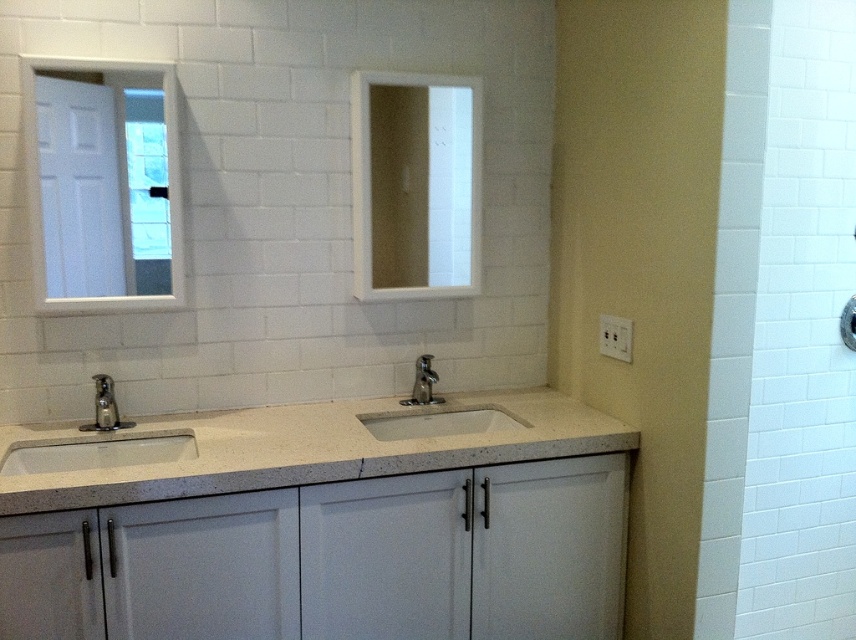
Who is shorter, white matte sink at lower left or matte silver faucet at left?

white matte sink at lower left

Is point (123, 445) positioned behind point (104, 406)?

Yes.

Measure the distance between point (x=156, y=442) and camera.

They are 6.95 feet apart.

Where is `white matte sink at lower left`? Image resolution: width=856 pixels, height=640 pixels. white matte sink at lower left is located at coordinates (97, 451).

Does white matte medicine cabinet at upper center have a greater height compared to matte silver faucet at left?

Yes.

Does white matte medicine cabinet at upper center appear on the right side of matte silver faucet at left?

Correct, you'll find white matte medicine cabinet at upper center to the right of matte silver faucet at left.

Which is in front, point (357, 80) or point (98, 417)?

Point (98, 417) is in front.

Locate an element on the screen. The width and height of the screenshot is (856, 640). white matte medicine cabinet at upper center is located at coordinates (415, 184).

Consider the image. Does matte white sink at left appear on the left side of matte silver faucet at left?

Incorrect, matte white sink at left is not on the left side of matte silver faucet at left.

Can you confirm if matte white sink at left is bigger than matte silver faucet at left?

Yes, matte white sink at left is bigger than matte silver faucet at left.

Is point (152, 433) positioned in front of point (99, 406)?

No.

This screenshot has width=856, height=640. I want to click on matte white sink at left, so click(98, 444).